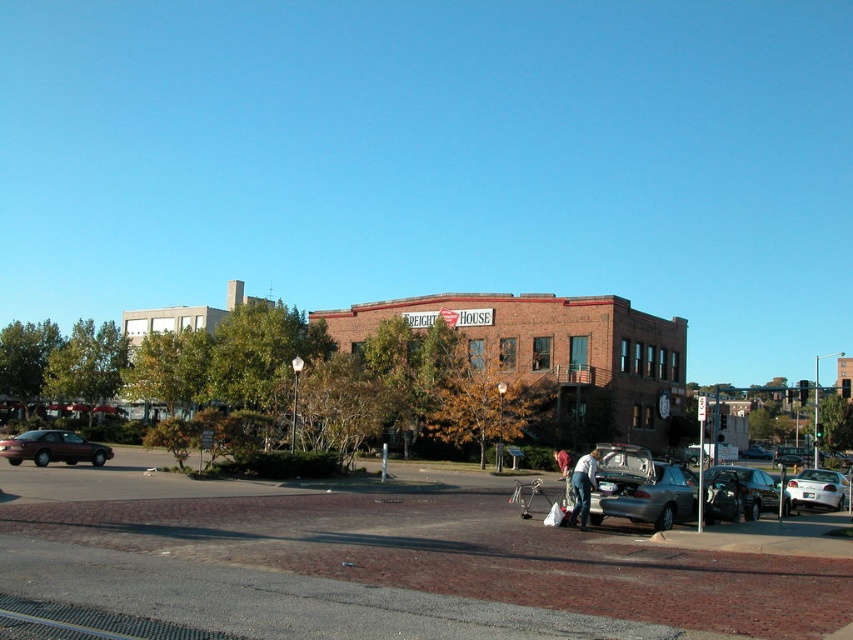
Question: Observing the image, what is the correct spatial positioning of metallic gray sedan at center in reference to denim jacket at lower center?

Choices:
 (A) right
 (B) left

Answer: (B)

Question: Does white glossy sedan at center have a smaller size compared to silver metallic sedan at center?

Choices:
 (A) yes
 (B) no

Answer: (A)

Question: Is metallic gray sedan at center bigger than white glossy sedan at center?

Choices:
 (A) yes
 (B) no

Answer: (B)

Question: Estimate the real-world distances between objects in this image. Which object is farther from the shiny maroon sedan at left?

Choices:
 (A) shiny silver suv at lower right
 (B) silver metallic sedan at center
 (C) white glossy sedan at center

Answer: (B)

Question: Considering the real-world distances, which object is farthest from the shiny silver suv at lower right?

Choices:
 (A) silver metallic sedan at center
 (B) denim pants at lower center

Answer: (A)

Question: Which of these objects is positioned closest to the shiny silver suv at lower right?

Choices:
 (A) denim jacket at lower center
 (B) silver metallic sedan at center

Answer: (A)